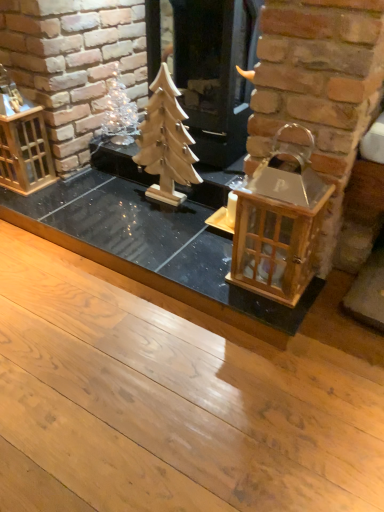
At what (x,y) coordinates should I click in order to perform the action: click on free spot in front of wooden christmas tree at center. Please return your answer as a coordinate pair (x, y). The width and height of the screenshot is (384, 512). Looking at the image, I should click on (152, 226).